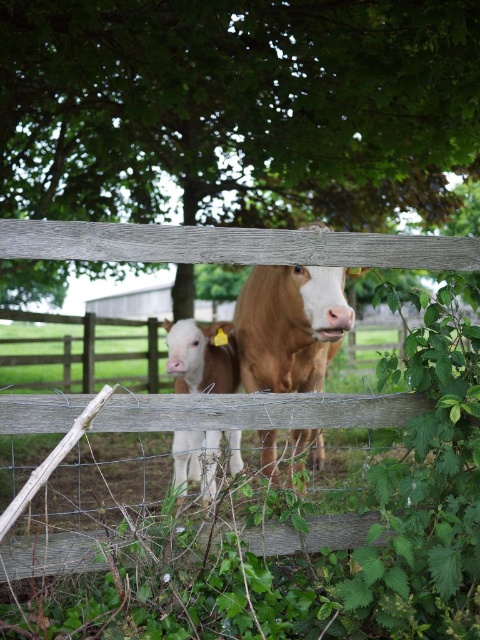
You are a photographer trying to capture both the green leafy tree at upper center and the white smooth calf at center in a single frame. Which object should you zoom in on to ensure both fit in the shot?

Since the green leafy tree at upper center is wider than the white smooth calf at center, you should zoom out to include both objects in the frame. Zooming in might cause one of them to be cut off.

You are standing in a field and see a wooden fence with two cows. There is a point marked at coordinates (236, 108). What object is located at that point?

The point at coordinates (236, 108) indicates a green leafy tree at upper center.

Based on the photo, you are standing in a field and see a cow at point [289,324]. What is the color of the cow at that point?

The cow at point [289,324] is brown matte.